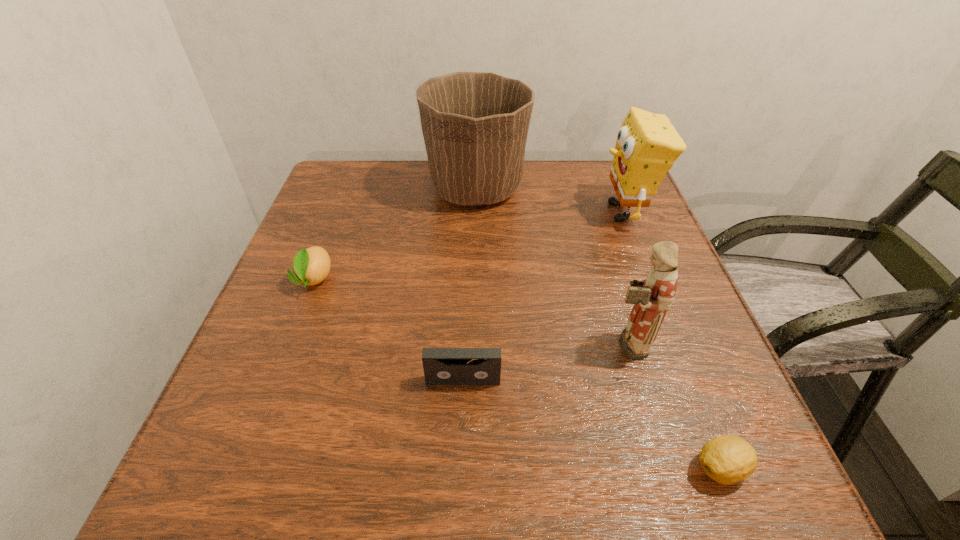
Identify the location of sponge located in the far edge section of the desktop. This screenshot has height=540, width=960. (647, 145).

Locate an element on the screen. The width and height of the screenshot is (960, 540). object that is positioned at the near edge is located at coordinates (728, 459).

Find the location of `object that is at the left edge`. object that is at the left edge is located at coordinates (312, 265).

The image size is (960, 540). I want to click on sponge that is at the right edge, so pyautogui.click(x=647, y=145).

The width and height of the screenshot is (960, 540). I want to click on figurine positioned at the right edge, so click(652, 297).

Where is `lemon located at the right edge`? Image resolution: width=960 pixels, height=540 pixels. lemon located at the right edge is located at coordinates (728, 459).

At what (x,y) coordinates should I click in order to perform the action: click on object situated at the far right corner. Please return your answer as a coordinate pair (x, y). The image size is (960, 540). Looking at the image, I should click on (647, 145).

Find the location of a particular element. object present at the near right corner is located at coordinates coord(728,459).

You are a GUI agent. You are given a task and a screenshot of the screen. Output one action in this format:
    pyautogui.click(x=<x>, y=<y>)
    Task: Click on the vacant space at the far edge of the desktop
    
    Given the screenshot: What is the action you would take?
    click(542, 199)

Where is `free space at the left edge`? Image resolution: width=960 pixels, height=540 pixels. free space at the left edge is located at coordinates (239, 433).